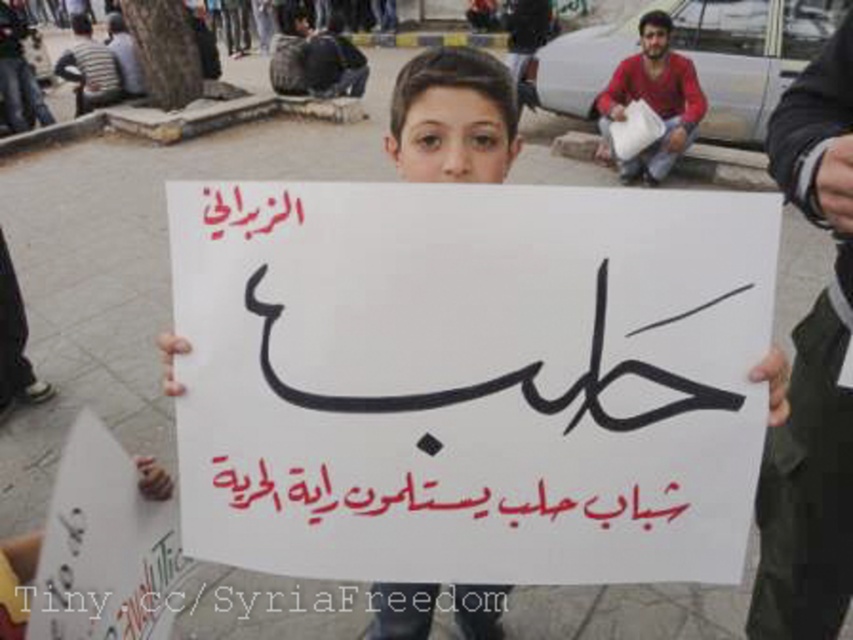
You are a photographer trying to capture the red calligraphy at center and the white paper at center in a single shot. Based on their positions, which object should you focus on first to ensure both are in focus?

The red calligraphy at center is closer to the viewer than the white paper at center. To ensure both are in focus, you should focus on the red calligraphy at center first, as it is the closer object.

You are an artist trying to sketch the scene. You notice the red calligraphy at center and the red cotton shirt at upper right. Which object should you draw first if you want to focus on the narrower one first?

The red calligraphy at center should be drawn first because its width is less than the red cotton shirt at upper right, making it narrower.

Based on the scene description, where is the white paper sign at center located in terms of coordinates?

The white paper sign at center is located at point coordinates of (x=469, y=380).